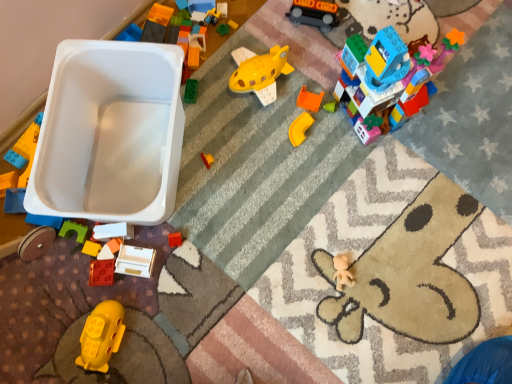
You are a GUI agent. You are given a task and a screenshot of the screen. Output one action in this format:
    pyautogui.click(x=<x>, y=<y>)
    Task: Click on the vacant space in between white matte block at lower left, which is the fifth toy from right to left, and multicolored plastic building block at upper right, which is the eighth toy in left-to-right order
    
    Given the screenshot: What is the action you would take?
    pyautogui.click(x=270, y=158)